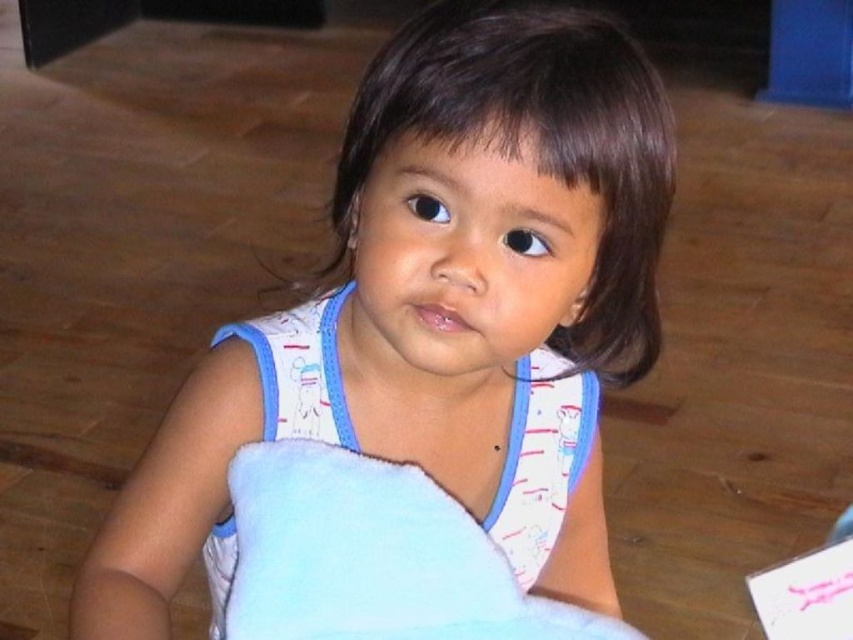
You are a photographer trying to capture a closeup of the white soft blanket at center. The camera you are using has a minimum focusing distance of 25 inches. Can you get the shot without moving the blanket?

The white soft blanket at center is 25.30 inches from camera, which is slightly beyond the camera minimum focusing distance of 25 inches. Therefore, you cannot get the closeup without moving the blanket closer.

From the picture: You are a photographer who wants to capture both the white soft blanket at center and the blue soft blanket at center in a single shot. Since the camera can only focus on one object at a time, which blanket should you focus on to ensure the taller one is in focus?

The white soft blanket at center is taller than the blue soft blanket at center, so you should focus on the white soft blanket at center to ensure the taller one is in focus.

You are a photographer setting up a shot of the child holding two blankets. You need to ensure both blankets are in focus. The camera you are using has a depth of field that can cover 6 inches. Can both the white soft blanket at center and blue soft blanket at center be in focus at the same time?

The distance between the white soft blanket at center and blue soft blanket at center is 6.94 inches. Since the camera can only cover 6 inches, the two blankets cannot both be in focus simultaneously.